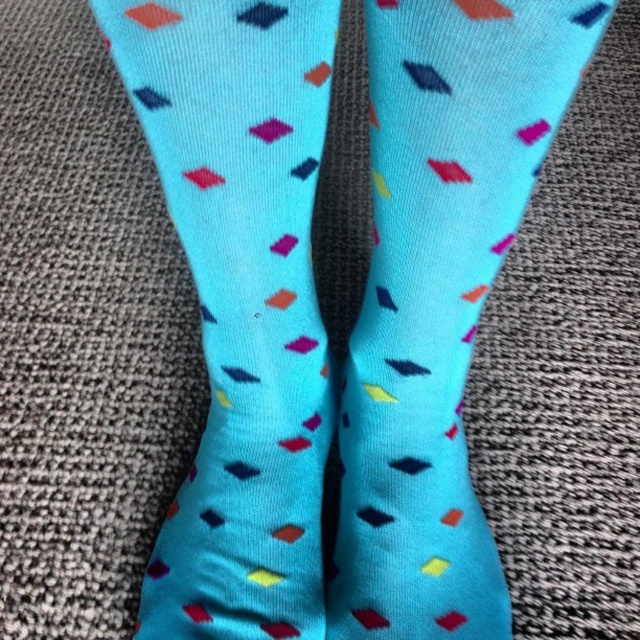
Question: Is matte blue socks at center further to the viewer compared to turquoise knitted socks at center?

Choices:
 (A) no
 (B) yes

Answer: (A)

Question: Can you confirm if matte blue socks at center is bigger than turquoise knitted socks at center?

Choices:
 (A) no
 (B) yes

Answer: (A)

Question: Does matte blue socks at center appear over turquoise knitted socks at center?

Choices:
 (A) no
 (B) yes

Answer: (A)

Question: Which point is closer to the camera?

Choices:
 (A) turquoise knitted socks at center
 (B) matte blue socks at center

Answer: (B)